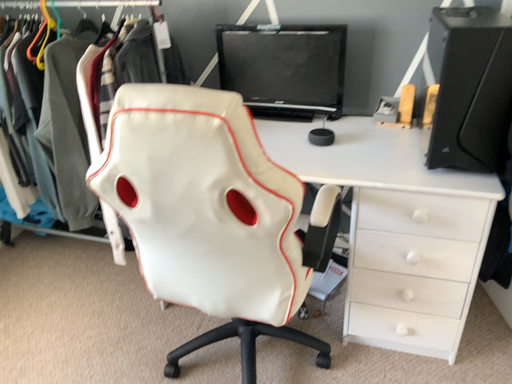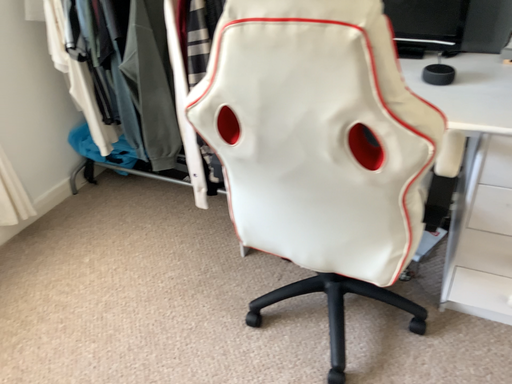
Question: Which way did the camera rotate in the video?

Choices:
 (A) rotated left
 (B) rotated right

Answer: (A)